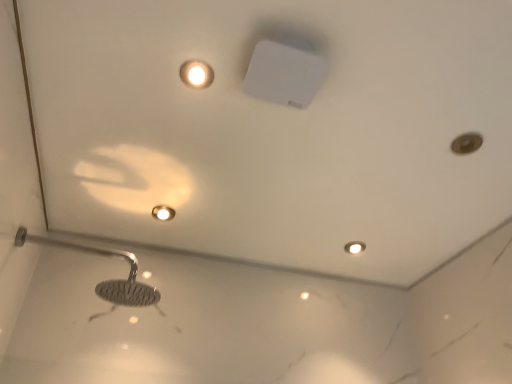
Question: From a real-world perspective, relative to matte white light fixture at bottom right, is matte gold droplight at upper center vertically above or below?

Choices:
 (A) above
 (B) below

Answer: (B)

Question: In the image, is matte gold droplight at upper center positioned in front of or behind matte white light fixture at bottom right?

Choices:
 (A) front
 (B) behind

Answer: (A)

Question: Which object is the closest to the matte gold droplight at upper center?

Choices:
 (A) matte white light fixture at bottom right
 (B) polished chrome shower head at lower left

Answer: (B)

Question: Which object is positioned farthest from the polished chrome shower head at lower left?

Choices:
 (A) matte white light fixture at bottom right
 (B) matte gold droplight at upper center

Answer: (A)